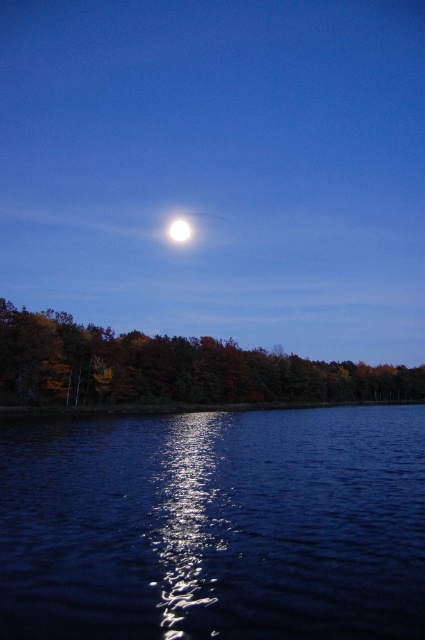
Which of these two, glistening dark water at center or autumn leaves at lower left, stands taller?

autumn leaves at lower left is taller.

Can you confirm if glistening dark water at center is positioned to the right of autumn leaves at lower left?

Incorrect, glistening dark water at center is not on the right side of autumn leaves at lower left.

Between point (138, 524) and point (263, 390), which one is positioned behind?

Positioned behind is point (263, 390).

Locate an element on the screen. The width and height of the screenshot is (425, 640). glistening dark water at center is located at coordinates (215, 525).

Between bright white moon at upper center and glistening dark water at center, which one appears on the left side from the viewer's perspective?

Positioned to the left is bright white moon at upper center.

Describe the element at coordinates (218, 168) in the screenshot. I see `bright white moon at upper center` at that location.

Identify the location of bright white moon at upper center. Image resolution: width=425 pixels, height=640 pixels. (218, 168).

How distant is autumn leaves at lower left from bright white orb at upper center?

The distance of autumn leaves at lower left from bright white orb at upper center is 698.82 feet.

Can you confirm if autumn leaves at lower left is positioned to the left of bright white orb at upper center?

No, autumn leaves at lower left is not to the left of bright white orb at upper center.

Is point (288, 396) positioned in front of point (184, 236)?

Yes.

The image size is (425, 640). Identify the location of autumn leaves at lower left. (172, 368).